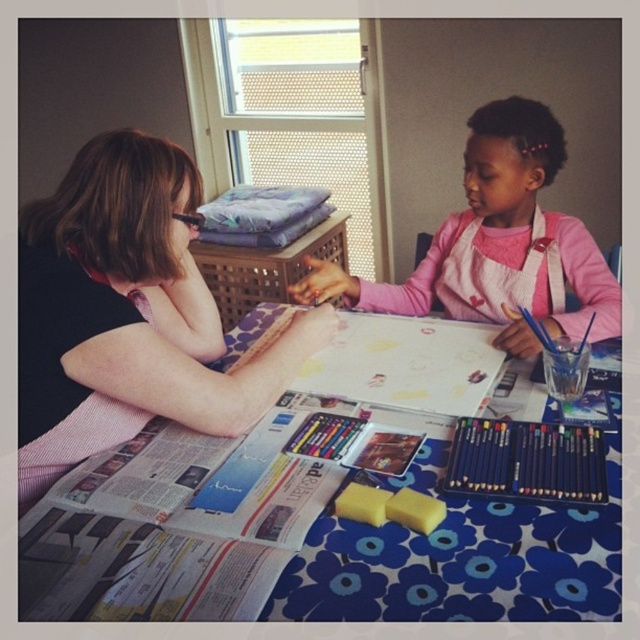
Question: Among these points, which one is nearest to the camera?

Choices:
 (A) (38, 332)
 (B) (552, 488)

Answer: (B)

Question: In this image, where is blonde hair at upper left located relative to matte black pencils at lower right?

Choices:
 (A) below
 (B) above

Answer: (B)

Question: Does pink fabric apron at upper right appear over matte black pencils at lower right?

Choices:
 (A) yes
 (B) no

Answer: (A)

Question: Can you confirm if blue floral tablecloth at center is positioned to the left of matte black pencils at lower right?

Choices:
 (A) yes
 (B) no

Answer: (A)

Question: Based on their relative distances, which object is farther from the blonde hair at upper left?

Choices:
 (A) matte black pencils at lower right
 (B) pink fabric apron at upper right
 (C) blue floral tablecloth at center

Answer: (A)

Question: Which object is positioned farthest from the blonde hair at upper left?

Choices:
 (A) pink fabric apron at upper right
 (B) matte black pencils at lower right
 (C) blue floral tablecloth at center

Answer: (B)